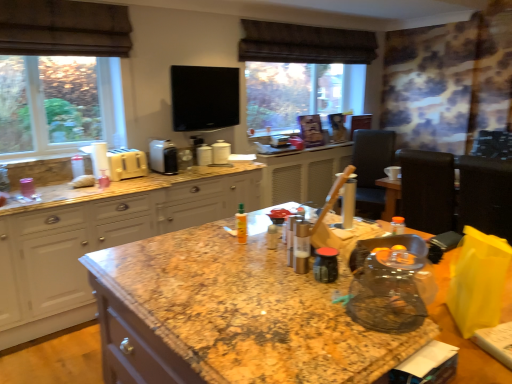
Find the location of a particular element. This screenshot has width=512, height=384. empty space that is to the right of white plastic toaster at center, which is the 3th appliance from right to left is located at coordinates (193, 170).